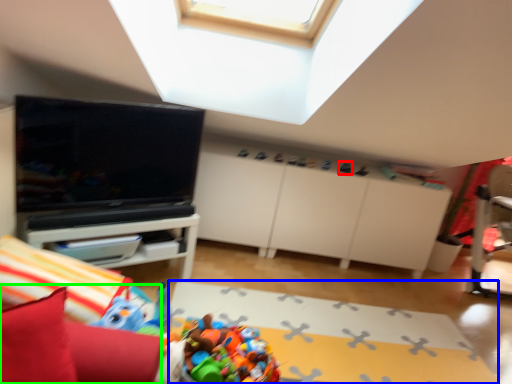
Question: Which object is the closest to the toy (highlighted by a red box)? Choose among these: plain (highlighted by a blue box) or bean bag chair (highlighted by a green box).

Choices:
 (A) plain
 (B) bean bag chair

Answer: (A)